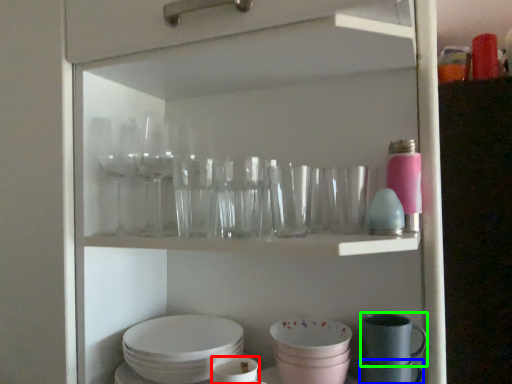
Question: Which object is the closest to the tableware (highlighted by a red box)? Choose among these: tableware (highlighted by a blue box) or tableware (highlighted by a green box).

Choices:
 (A) tableware
 (B) tableware

Answer: (A)